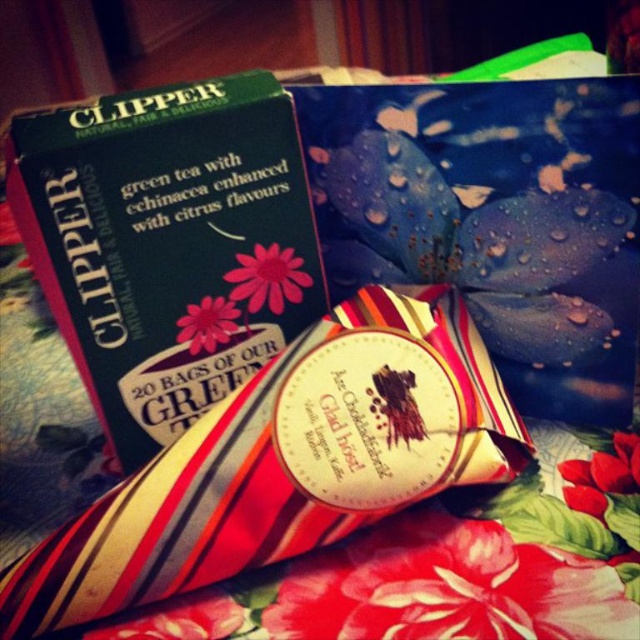
Can you confirm if green matte box at upper left is positioned below pink paper flower at upper left?

No, green matte box at upper left is not below pink paper flower at upper left.

Can you confirm if green matte box at upper left is shorter than pink paper flower at upper left?

Incorrect, green matte box at upper left's height does not fall short of pink paper flower at upper left's.

Does point (209, 257) lie in front of point (205, 330)?

Yes, it is in front of point (205, 330).

Identify the location of green matte box at upper left. (168, 241).

Can you confirm if red matte flower at center is shorter than pink paper flower at upper left?

No.

Between red matte flower at center and pink paper flower at upper left, which one is positioned higher?

pink paper flower at upper left

Where is `red matte flower at center`? The image size is (640, 640). red matte flower at center is located at coordinates (602, 476).

You are a GUI agent. You are given a task and a screenshot of the screen. Output one action in this format:
    pyautogui.click(x=<x>, y=<y>)
    Task: Click on the red matte flower at center
    The image size is (640, 640).
    Given the screenshot: What is the action you would take?
    pyautogui.click(x=602, y=476)

Is striped paper cone at center to the right of red matte flower at center from the viewer's perspective?

In fact, striped paper cone at center is to the left of red matte flower at center.

Does point (38, 573) lie in front of point (636, 486)?

That is True.

Image resolution: width=640 pixels, height=640 pixels. Find the location of `striped paper cone at center`. striped paper cone at center is located at coordinates (285, 461).